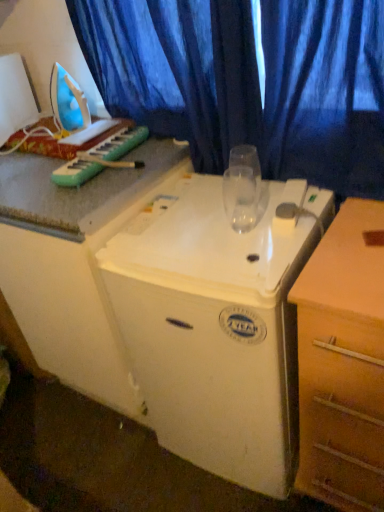
Find the location of a particular element. spots to the right of transparent glass at center is located at coordinates (302, 218).